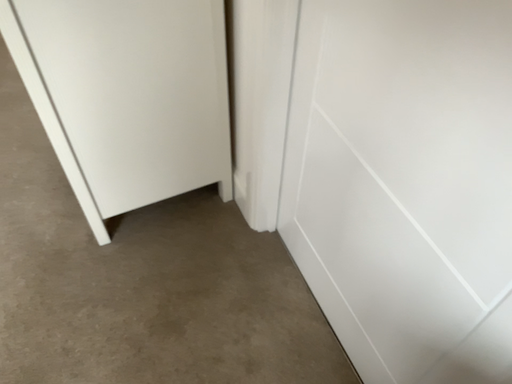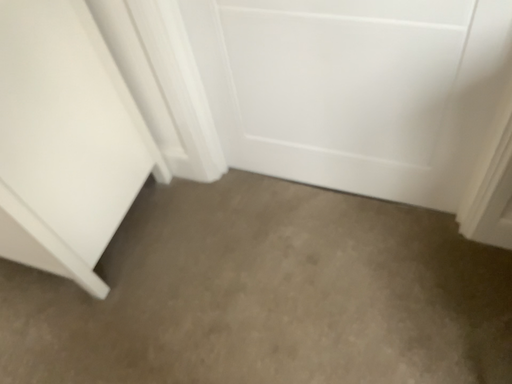
Question: How did the camera likely rotate when shooting the video?

Choices:
 (A) rotated left
 (B) rotated right

Answer: (B)